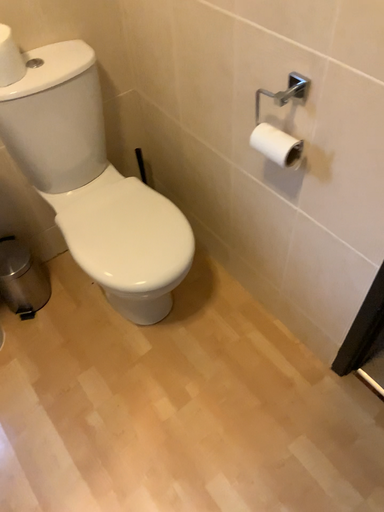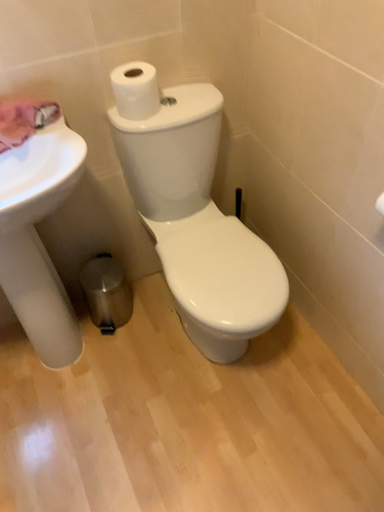
Question: Which way did the camera rotate in the video?

Choices:
 (A) rotated left
 (B) rotated right

Answer: (A)